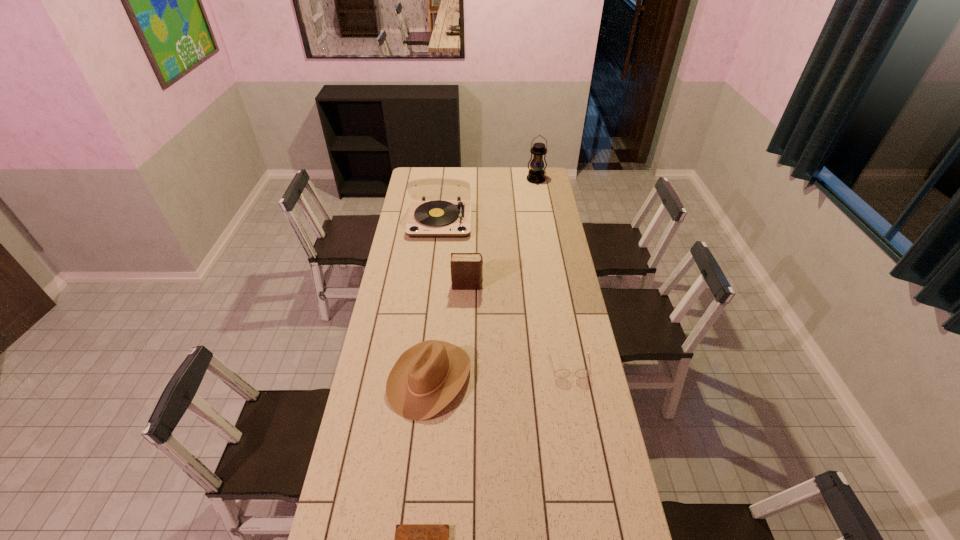
Find the location of a particular element. This screenshot has height=540, width=960. free space between the farther diary and the farthest object is located at coordinates (x=502, y=233).

Find the location of `free space between the taller diary and the farthest object`. free space between the taller diary and the farthest object is located at coordinates (502, 233).

This screenshot has width=960, height=540. In order to click on free space that is in between the second shortest object and the farther diary in this screenshot , I will do `click(518, 325)`.

This screenshot has width=960, height=540. I want to click on vacant space in between the spectacles and the farthest object, so click(x=553, y=272).

Where is `vacant space in between the farthest object and the second shortest object`? The height and width of the screenshot is (540, 960). vacant space in between the farthest object and the second shortest object is located at coordinates (553, 272).

I want to click on vacant area that lies between the cowboy hat and the fifth nearest object, so click(435, 300).

What are the coordinates of `vacant space that is in between the lantern and the fifth nearest object` in the screenshot? It's located at (488, 200).

I want to click on free spot between the fifth tallest object and the taller diary, so click(518, 325).

You are a GUI agent. You are given a task and a screenshot of the screen. Output one action in this format:
    pyautogui.click(x=<x>, y=<y>)
    Task: Click on the object that is the second closest to the second shortest object
    
    Given the screenshot: What is the action you would take?
    pyautogui.click(x=466, y=268)

Select which object is the fifth closest to the cowboy hat. Please provide its 2D coordinates. Your answer should be formatted as a tuple, i.e. [(x, y)], where the tuple contains the x and y coordinates of a point satisfying the conditions above.

[(536, 175)]